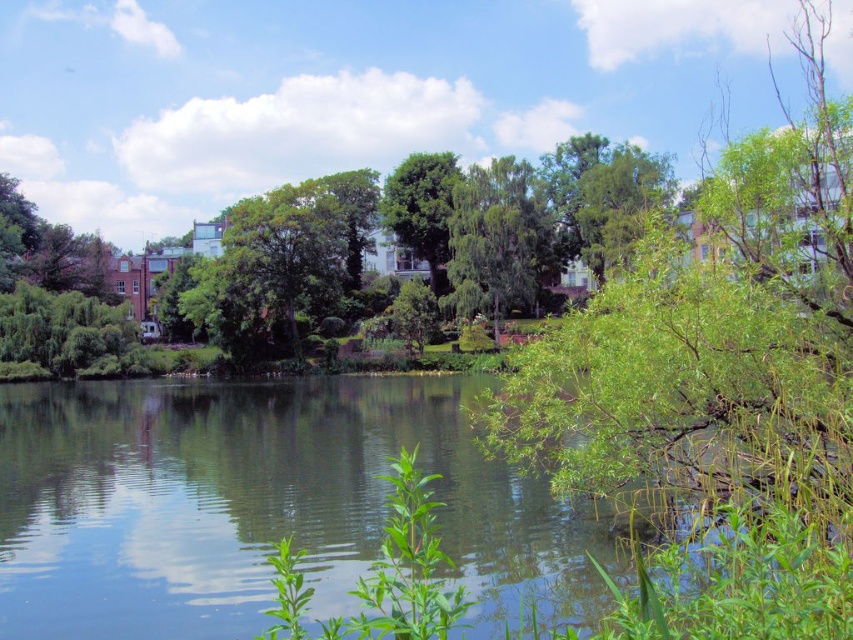
Can you confirm if green leafy water at center is taller than green leafy branch at center?

No.

Which is in front, point (78, 627) or point (573, 458)?

Point (78, 627) is in front.

Who is more distant from viewer, (54,388) or (602,424)?

Positioned behind is point (54,388).

Locate an element on the screen. Image resolution: width=853 pixels, height=640 pixels. green leafy water at center is located at coordinates (260, 504).

Does green leafy branch at center have a greater height compared to green leafy tree at center?

Indeed, green leafy branch at center has a greater height compared to green leafy tree at center.

Is green leafy branch at center shorter than green leafy tree at center?

No, green leafy branch at center is not shorter than green leafy tree at center.

Which is behind, point (785, 442) or point (517, 205)?

Positioned behind is point (517, 205).

The width and height of the screenshot is (853, 640). I want to click on green leafy branch at center, so click(712, 336).

Is green leafy water at center bigger than green leafy tree at center?

Yes.

Which is above, green leafy water at center or green leafy tree at center?

green leafy tree at center is above.

The image size is (853, 640). Describe the element at coordinates (260, 504) in the screenshot. I see `green leafy water at center` at that location.

This screenshot has width=853, height=640. What are the coordinates of `green leafy water at center` in the screenshot? It's located at (260, 504).